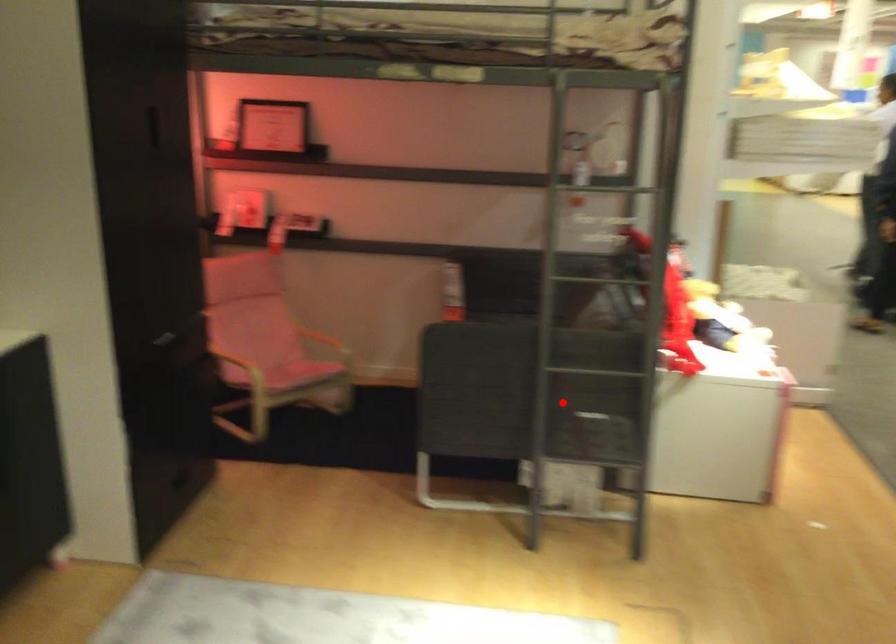
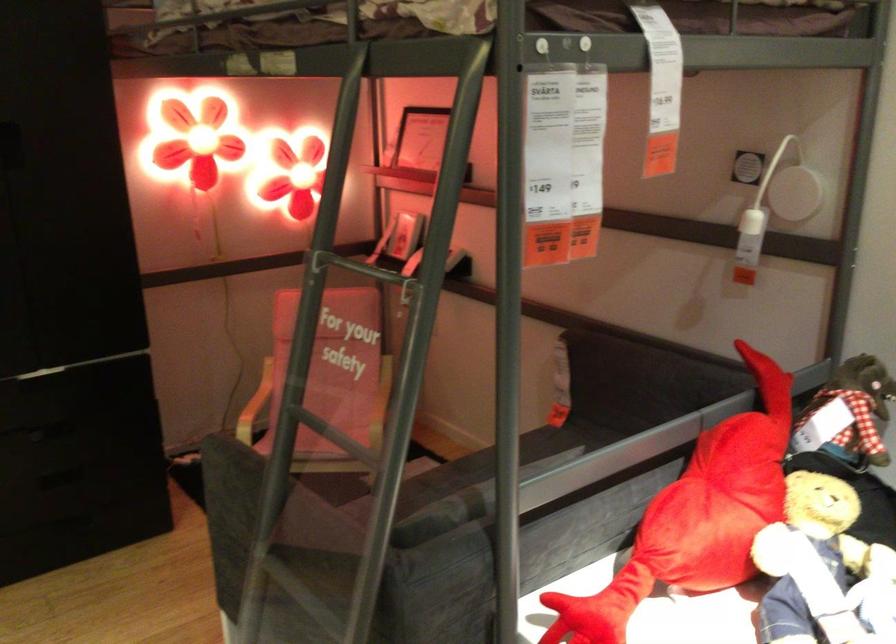
In the second image, find the point that corresponds to the highlighted location in the first image.

(293, 609)